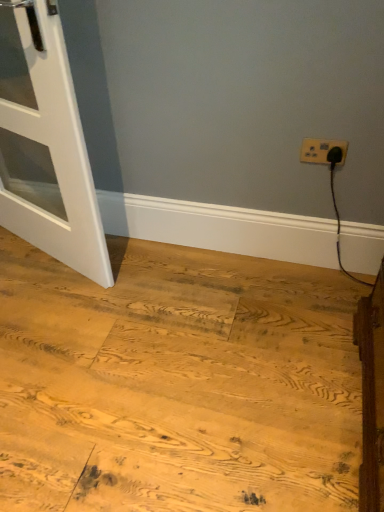
The image size is (384, 512). I want to click on free spot to the right of white matte door at left, so pos(165,280).